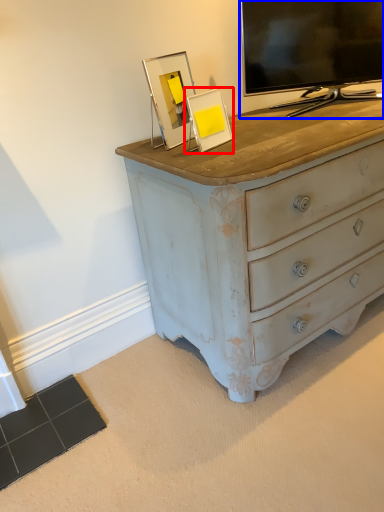
Question: Which point is closer to the camera, picture frame (highlighted by a red box) or television (highlighted by a blue box)?

Choices:
 (A) picture frame
 (B) television

Answer: (A)